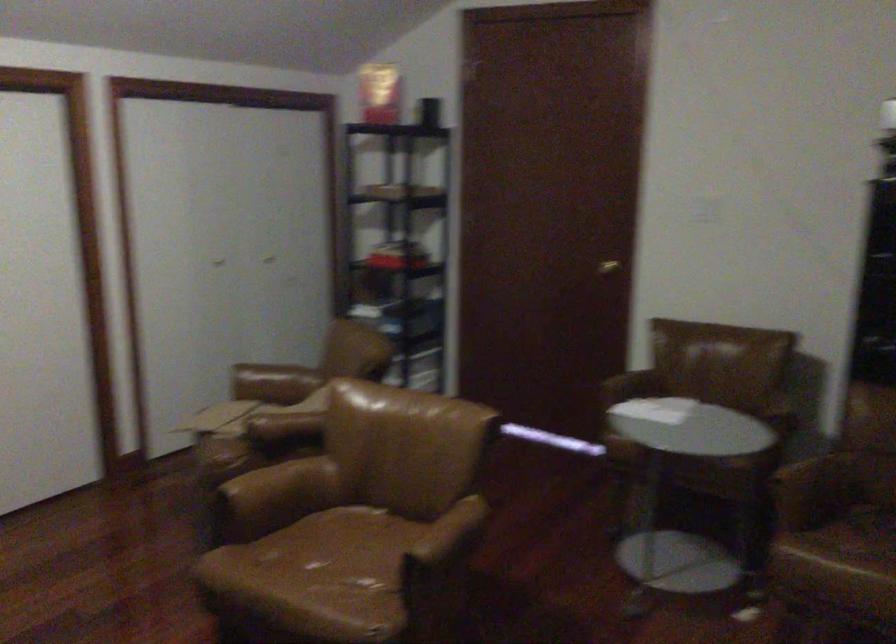
What do you see at coordinates (607, 267) in the screenshot? I see `a gold door handle` at bounding box center [607, 267].